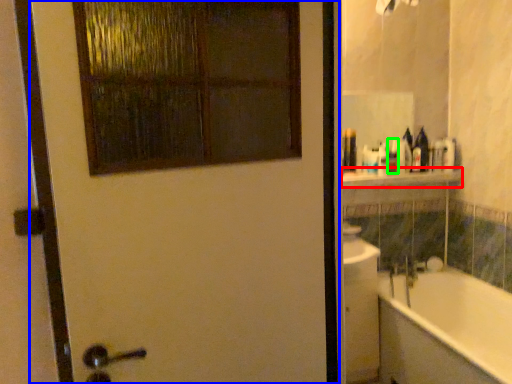
Question: Which object is the farthest from balustrade (highlighted by a red box)? Choose among these: door (highlighted by a blue box) or toiletry (highlighted by a green box).

Choices:
 (A) door
 (B) toiletry

Answer: (A)